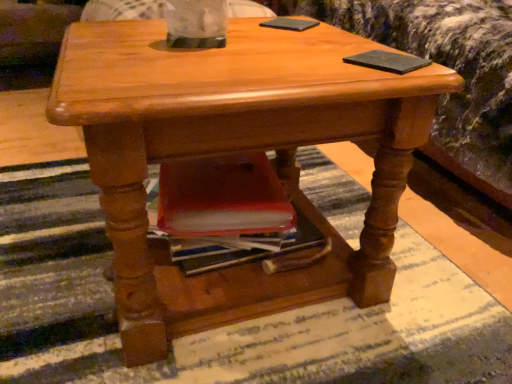
The height and width of the screenshot is (384, 512). I want to click on free point behind black matte pad at upper right, which appears as the first pad when viewed from the front, so click(x=341, y=43).